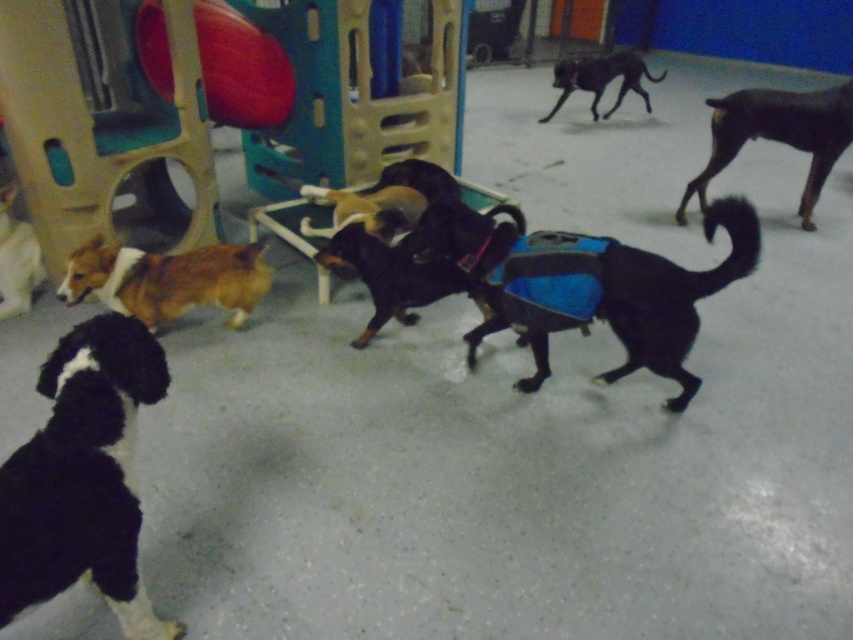
You are a dog owner trying to identify your pets in the play area. You have two dogs with you. One has a black smooth coat at right and the other has brown and white fur at lower left. Which of your dogs is bigger?

The black smooth coat at right is larger in size than the brown and white fur at lower left, so the dog with the black smooth coat at right is bigger.

You are a photographer trying to capture a photo of the black dog with white markings on its chest and face and the small brown and white dog. You want to ensure both dogs are in focus. Given their positions at point coordinates point (93, 339) and point (778, 104) respectively, which dog should you focus on first to ensure both are in focus?

You should focus on the black dog with white markings on its chest and face at point (93, 339) first because it is closer to the camera. Since it is closer, focusing on it will help ensure the small brown and white dog at point (778, 104), which is farther away, remains in focus as well.